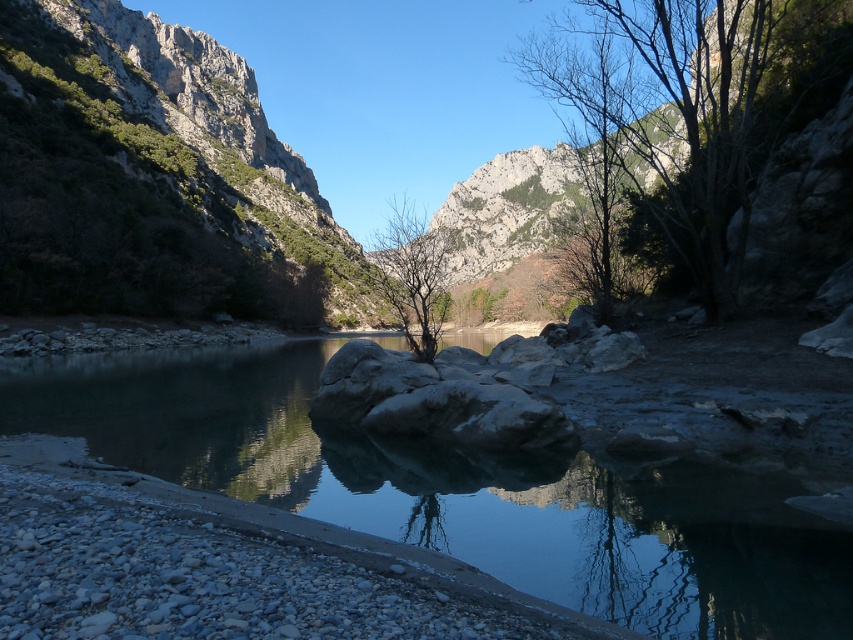
Consider the image. You are standing at the edge of the river and want to reach the green leafy tree at upper right. Which direction should you move to get closer to it without crossing the clear water at center?

You should move to the right side of the clear water at center because the green leafy tree at upper right is located on the right side of the image, and the clear water at center is closer to you than the tree. Moving right would bring you closer to the tree without crossing the water.

You are an outdoor photographer planning to capture the reflection of the bare branches at center in the clear water at center. Based on the scene, can you confirm if the reflection will be visible?

The clear water at center is in front of the bare branches at center, so the reflection of the bare branches at center would be visible in the clear water at center since the water is calm and reflective as described in the scene.

From the picture: You are an explorer trying to navigate through the valley. You see the clear water at center and the green leafy tree at upper right. Which object is located to the right of the other?

The clear water at center is positioned on the left side of green leafy tree at upper right, so the green leafy tree at upper right is to the right of the clear water at center.